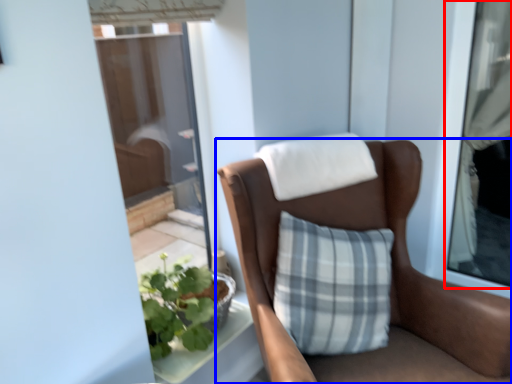
Question: Which of the following is the farthest to the observer, window (highlighted by a red box) or chair (highlighted by a blue box)?

Choices:
 (A) window
 (B) chair

Answer: (A)